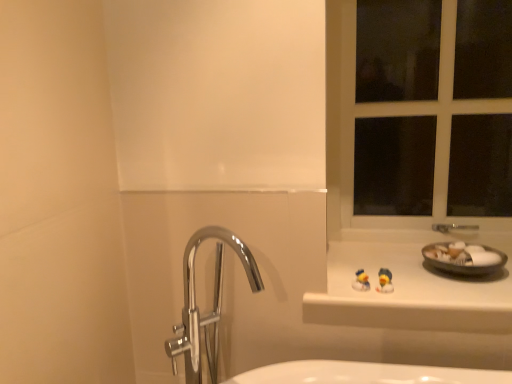
Question: From the image's perspective, relative to polished chrome tap at center, is matte gray bowl at right above or below?

Choices:
 (A) above
 (B) below

Answer: (A)

Question: In terms of width, does matte gray bowl at right look wider or thinner when compared to polished chrome tap at center?

Choices:
 (A) wide
 (B) thin

Answer: (A)

Question: Which object is positioned closest to the white plastic window frame at upper right?

Choices:
 (A) polished chrome tap at center
 (B) matte gray bowl at right
 (C) yellow rubber duck at center, which appears as the second miniature when viewed from the left
 (D) blue rubber duck at center, marked as the 2th miniature in a right-to-left arrangement
 (E) white glossy counter top at upper right

Answer: (B)

Question: Which is farther from the white glossy counter top at upper right?

Choices:
 (A) matte gray bowl at right
 (B) polished chrome tap at center
 (C) blue rubber duck at center, marked as the 2th miniature in a right-to-left arrangement
 (D) yellow rubber duck at center, the first miniature in the right-to-left sequence
 (E) white plastic window frame at upper right

Answer: (B)